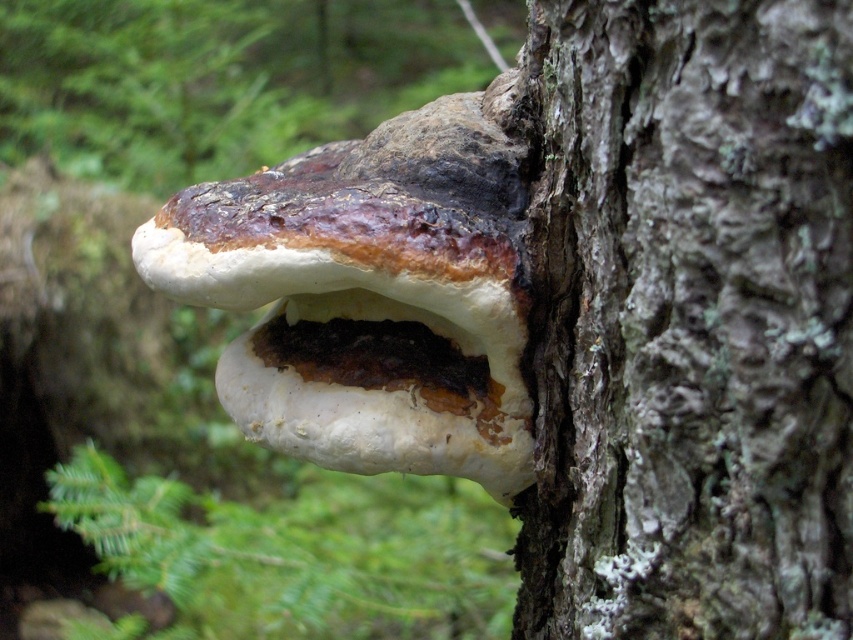
Question: Among these points, which one is nearest to the camera?

Choices:
 (A) (810, 212)
 (B) (495, 189)

Answer: (A)

Question: Which point is farther to the camera?

Choices:
 (A) (401, 433)
 (B) (782, 124)

Answer: (A)

Question: Can you confirm if smooth bark tree trunk at center is positioned below white leathery fungus at center?

Choices:
 (A) no
 (B) yes

Answer: (B)

Question: Does smooth bark tree trunk at center appear over white leathery fungus at center?

Choices:
 (A) no
 (B) yes

Answer: (A)

Question: Which of the following is the farthest from the observer?

Choices:
 (A) white leathery fungus at center
 (B) smooth bark tree trunk at center

Answer: (A)

Question: Does smooth bark tree trunk at center have a smaller size compared to white leathery fungus at center?

Choices:
 (A) yes
 (B) no

Answer: (A)